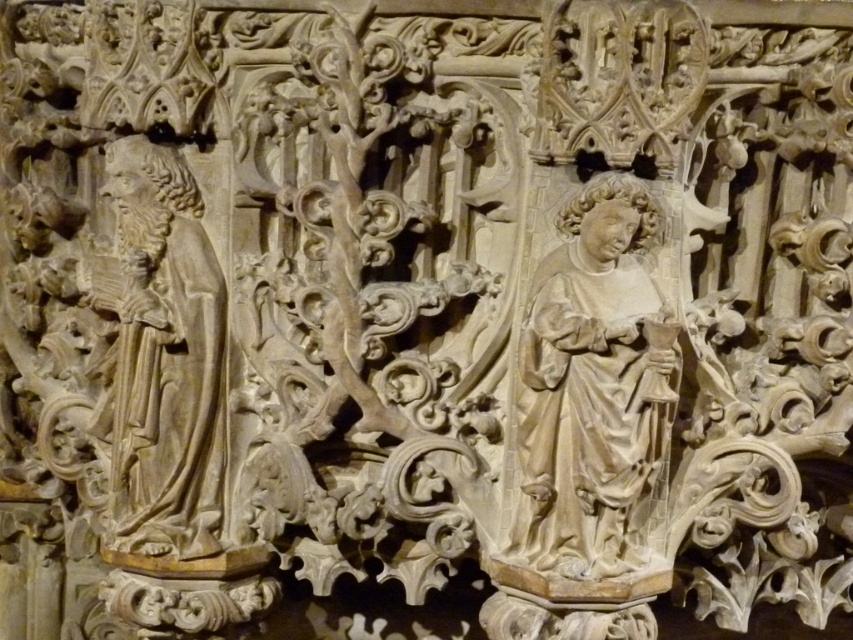
Question: Which of the following is the farthest from the observer?

Choices:
 (A) (158, 365)
 (B) (640, 337)

Answer: (A)

Question: Does smooth beige statue at center appear on the right side of carved stone figure at left?

Choices:
 (A) no
 (B) yes

Answer: (B)

Question: Does smooth beige statue at center appear on the left side of carved stone figure at left?

Choices:
 (A) no
 (B) yes

Answer: (A)

Question: Among these points, which one is nearest to the camera?

Choices:
 (A) (136, 512)
 (B) (583, 211)

Answer: (B)

Question: Does smooth beige statue at center have a smaller size compared to carved stone figure at left?

Choices:
 (A) yes
 (B) no

Answer: (A)